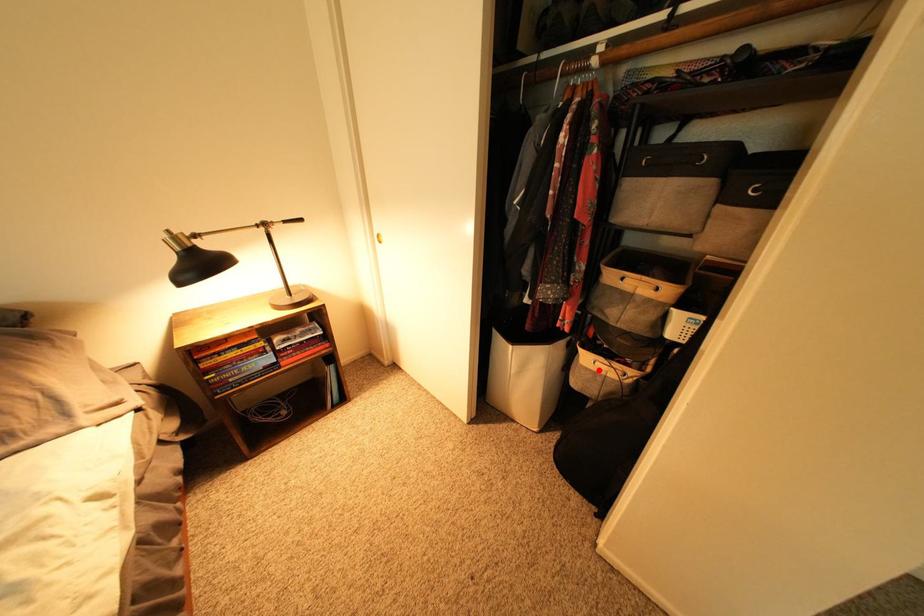
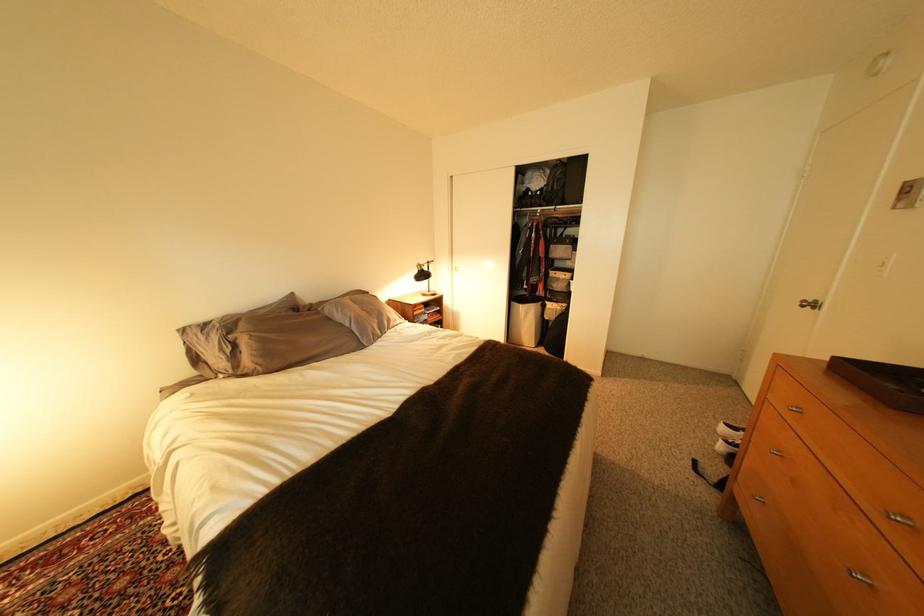
Where in the second image is the point corresponding to the highlighted location from the first image?

(563, 310)